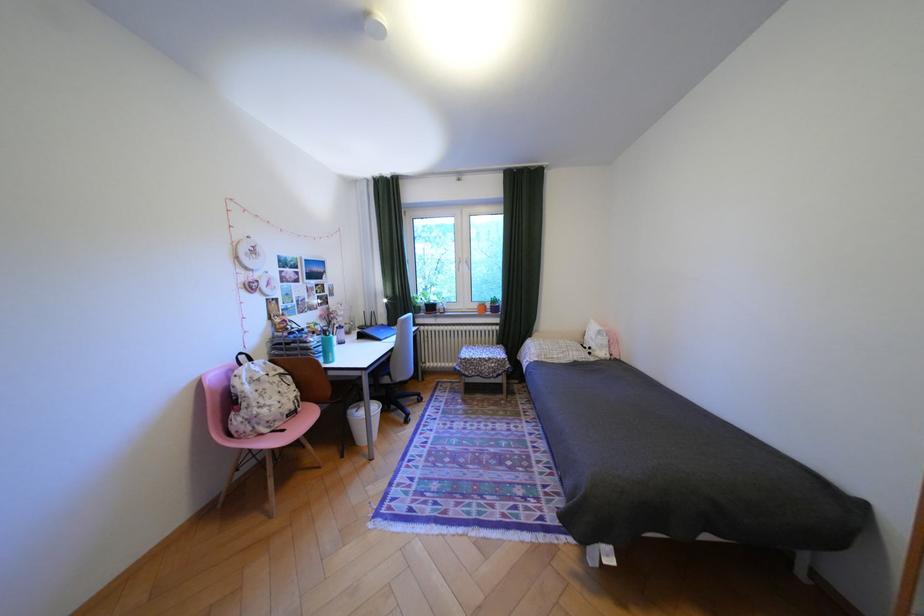
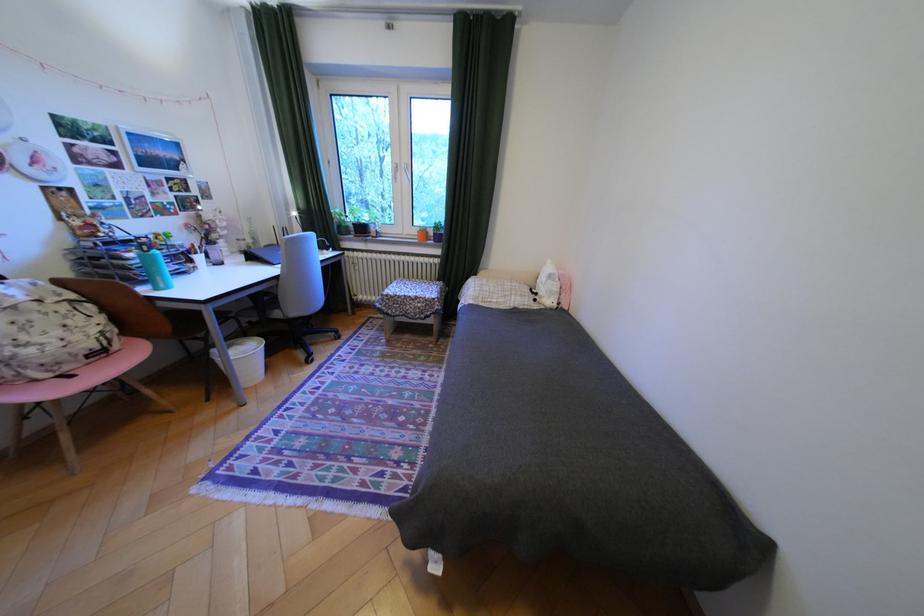
The point at (280,386) is marked in the first image. Where is the corresponding point in the second image?

(49, 317)